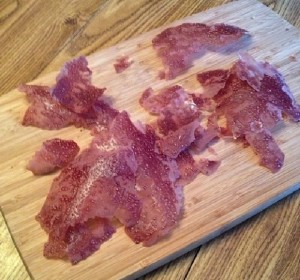
Locate an element on the screen. The width and height of the screenshot is (300, 280). wood countertop is located at coordinates (79, 27).